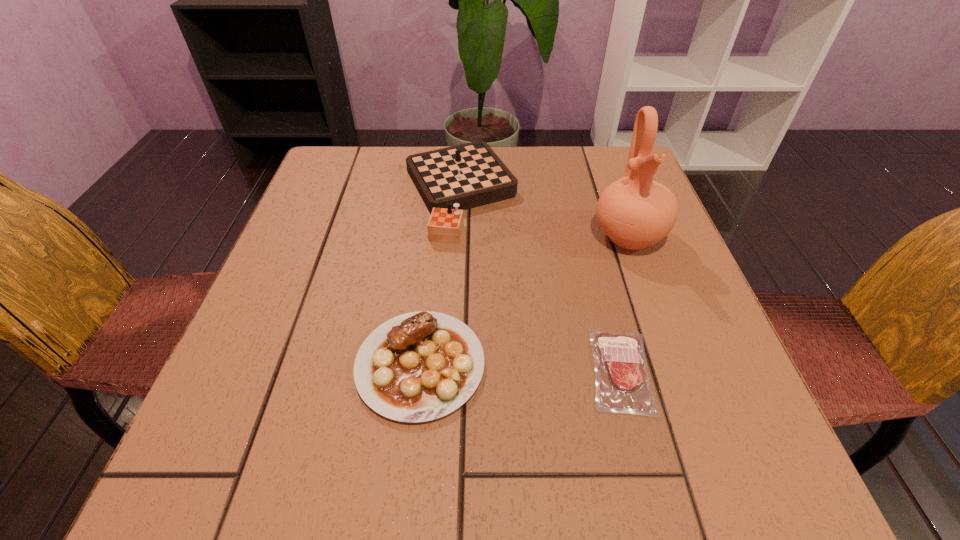
Identify the location of object located at the far edge. The width and height of the screenshot is (960, 540). (449, 180).

This screenshot has width=960, height=540. Find the location of `pottery that is positioned at the right edge`. pottery that is positioned at the right edge is located at coordinates (635, 212).

Where is `steak located at the right edge`? steak located at the right edge is located at coordinates (622, 384).

I want to click on free space at the far edge of the desktop, so click(572, 191).

Locate an element on the screen. vacant space at the near edge is located at coordinates (300, 482).

You are a GUI agent. You are given a task and a screenshot of the screen. Output one action in this format:
    pyautogui.click(x=<x>, y=<y>)
    Task: Click on the free region at the left edge of the desktop
    
    Given the screenshot: What is the action you would take?
    pyautogui.click(x=285, y=399)

Identify the location of vacant region at the right edge of the desktop. The width and height of the screenshot is (960, 540). (595, 221).

In the image, there is a desktop. Identify the location of vacant space at the far left corner. (384, 152).

In the image, there is a desktop. At what (x,y) coordinates should I click in order to perform the action: click on free region at the far right corner. Please return your answer as a coordinate pair (x, y). The image size is (960, 540). Looking at the image, I should click on (592, 159).

You are a GUI agent. You are given a task and a screenshot of the screen. Output one action in this format:
    pyautogui.click(x=<x>, y=<y>)
    Task: Click on the free space between the taller steak and the third shortest object
    The image size is (960, 540).
    Given the screenshot: What is the action you would take?
    440,279